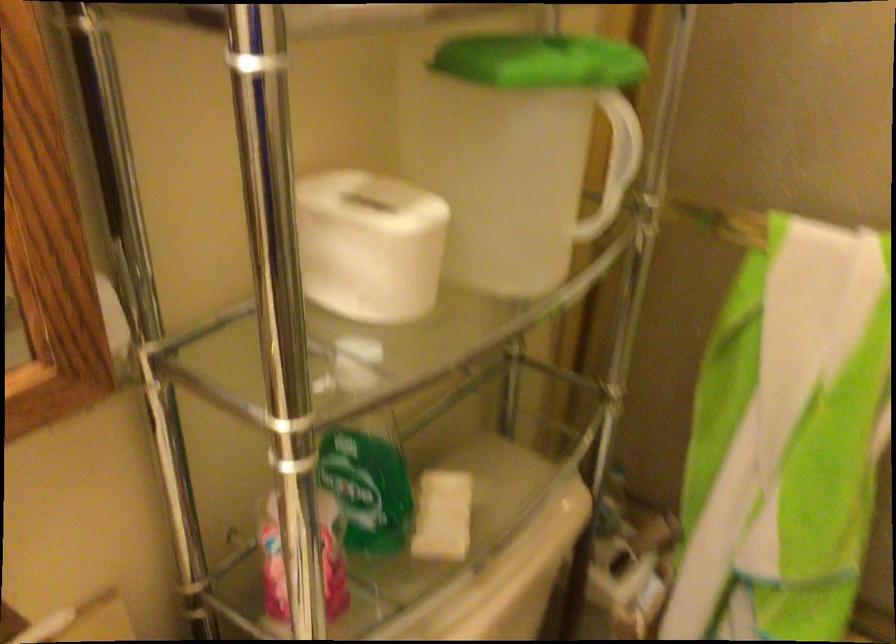
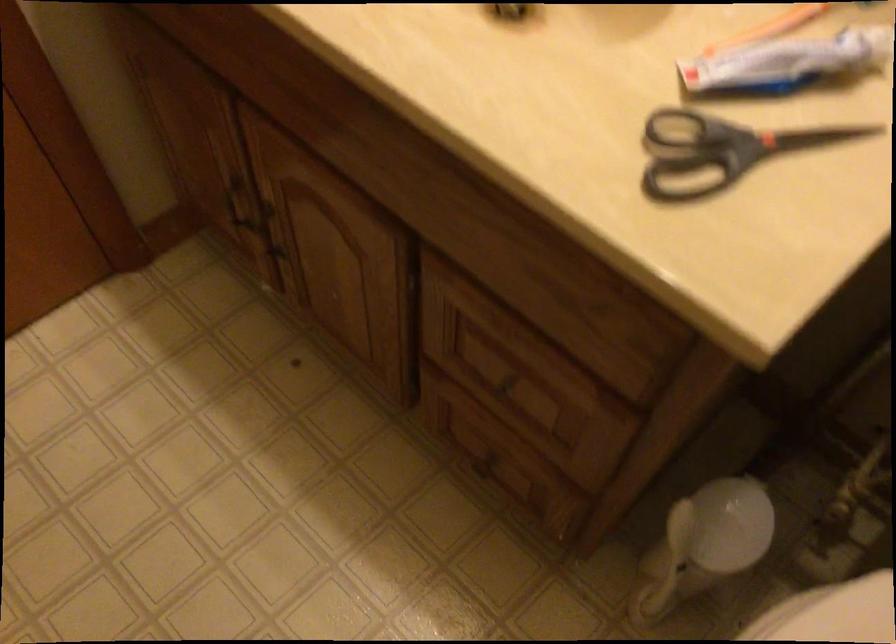
From the picture: Based on the continuous images, in which direction is the camera rotating?

The camera's rotation is toward left-down.